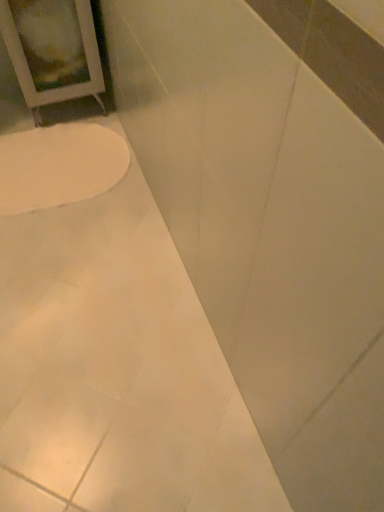
Question: Does white glossy bathtub at lower left come behind white glossy toilet at lower left?

Choices:
 (A) no
 (B) yes

Answer: (A)

Question: Can you confirm if white glossy bathtub at lower left is shorter than white glossy toilet at lower left?

Choices:
 (A) no
 (B) yes

Answer: (A)

Question: Would you say white glossy toilet at lower left is part of white glossy bathtub at lower left's contents?

Choices:
 (A) yes
 (B) no

Answer: (A)

Question: Is white glossy bathtub at lower left touching white glossy toilet at lower left?

Choices:
 (A) no
 (B) yes

Answer: (A)

Question: Is white glossy bathtub at lower left facing away from white glossy toilet at lower left?

Choices:
 (A) yes
 (B) no

Answer: (B)

Question: Does white glossy bathtub at lower left have a lesser width compared to white glossy toilet at lower left?

Choices:
 (A) no
 (B) yes

Answer: (A)

Question: Is white glossy toilet at lower left positioned with its back to white glossy bathtub at lower left?

Choices:
 (A) yes
 (B) no

Answer: (A)

Question: Does white glossy toilet at lower left lie in front of white glossy bathtub at lower left?

Choices:
 (A) yes
 (B) no

Answer: (B)

Question: From the image's perspective, would you say white glossy toilet at lower left is positioned over white glossy bathtub at lower left?

Choices:
 (A) yes
 (B) no

Answer: (A)

Question: Does white glossy toilet at lower left turn towards white glossy bathtub at lower left?

Choices:
 (A) yes
 (B) no

Answer: (A)

Question: Can you confirm if white glossy toilet at lower left is positioned to the right of white glossy bathtub at lower left?

Choices:
 (A) yes
 (B) no

Answer: (B)

Question: Does white glossy toilet at lower left come behind white glossy bathtub at lower left?

Choices:
 (A) no
 (B) yes

Answer: (B)

Question: Is point (79, 152) closer or farther from the camera than point (130, 300)?

Choices:
 (A) closer
 (B) farther

Answer: (B)